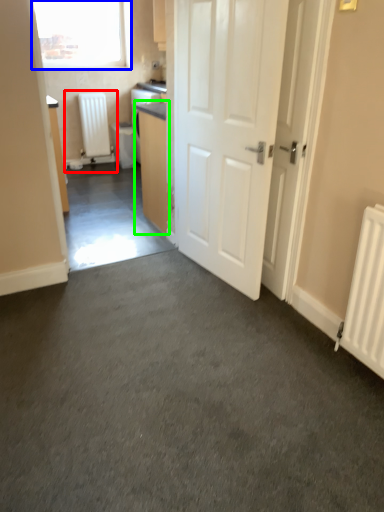
Question: Based on their relative distances, which object is nearer to water heater (highlighted by a red box)? Choose from window (highlighted by a blue box) and cabinetry (highlighted by a green box).

Choices:
 (A) window
 (B) cabinetry

Answer: (A)